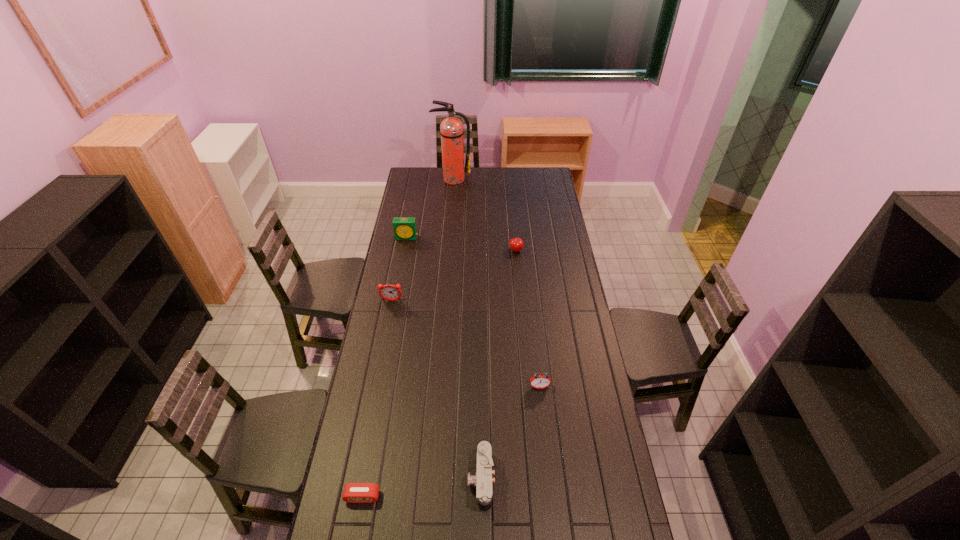
Image resolution: width=960 pixels, height=540 pixels. Find the location of `vacant region located at the nozzle of the farthest object`. vacant region located at the nozzle of the farthest object is located at coordinates (449, 224).

Image resolution: width=960 pixels, height=540 pixels. In order to click on vacant space positioned 0.170m on the front-facing side of the second farthest object in this screenshot , I will do `click(402, 261)`.

The height and width of the screenshot is (540, 960). I want to click on vacant area located 0.400m on the front-facing side of the second farthest alarm clock, so click(377, 377).

At what (x,y) coordinates should I click in order to perform the action: click on blank space located 0.400m on the clock face of the rightmost alarm clock. Please return your answer as a coordinate pair (x, y). Image resolution: width=960 pixels, height=540 pixels. Looking at the image, I should click on (552, 500).

Where is `vacant space positioned 0.340m on the left of the third farthest object`? The height and width of the screenshot is (540, 960). vacant space positioned 0.340m on the left of the third farthest object is located at coordinates (443, 251).

Identify the location of free space located 0.050m on the lens of the camera. The height and width of the screenshot is (540, 960). (453, 481).

The height and width of the screenshot is (540, 960). Find the location of `free space located 0.090m on the lens of the camera`. free space located 0.090m on the lens of the camera is located at coordinates (441, 481).

The image size is (960, 540). Find the location of `blank area located 0.350m on the lens of the camera`. blank area located 0.350m on the lens of the camera is located at coordinates (362, 481).

What are the coordinates of `free location located on the front-facing side of the shortest alarm clock` in the screenshot? It's located at (355, 535).

Where is `object at the far edge`? object at the far edge is located at coordinates (451, 129).